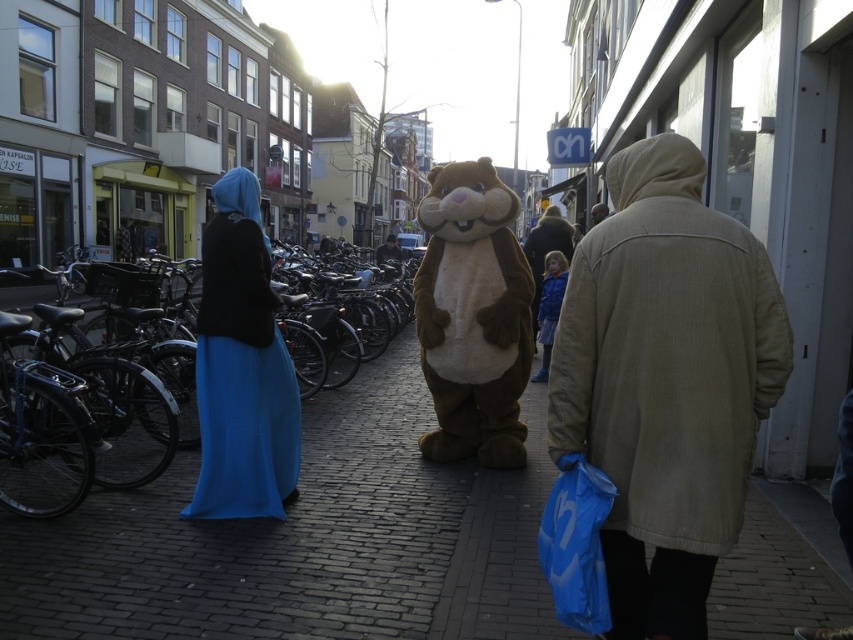
You are a tourist in this European town and you see the fuzzy brown teddy at center and the blue fabric dress at left. Which object is positioned to the right of the other?

The fuzzy brown teddy at center is to the right of the blue fabric dress at left.

You are standing on the cobblestone street in the European town and want to place a small bench exactly at the center of the brick pavement at center. According to the image, where should you place the bench?

The brick pavement at center is located at point (305, 540), so you should place the bench at those coordinates to position it exactly at the center of the brick pavement at center.